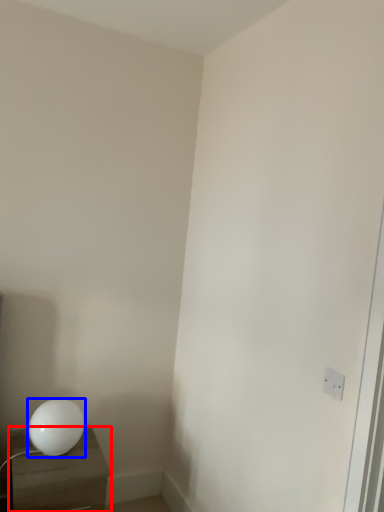
Question: Which object is closer to the camera taking this photo, nightstand (highlighted by a red box) or lamp (highlighted by a blue box)?

Choices:
 (A) nightstand
 (B) lamp

Answer: (A)